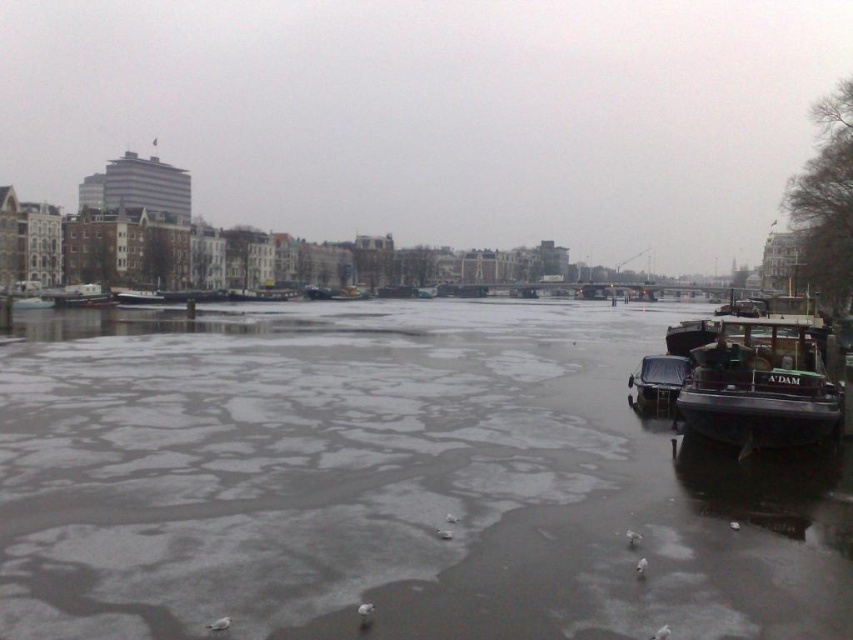
Question: Does dark gray wooden boat at right lie behind dark blue matte boat at right?

Choices:
 (A) yes
 (B) no

Answer: (B)

Question: Which object is farther from the camera taking this photo?

Choices:
 (A) dark gray wooden boat at right
 (B) dark blue matte boat at right

Answer: (B)

Question: Which point is farther to the camera?

Choices:
 (A) dark gray wooden boat at right
 (B) dark blue matte boat at right

Answer: (B)

Question: Which point appears farthest from the camera in this image?

Choices:
 (A) (659, 356)
 (B) (801, 305)

Answer: (B)

Question: Does dark gray wooden boat at right have a greater width compared to dark blue matte boat at right?

Choices:
 (A) no
 (B) yes

Answer: (B)

Question: Does dark gray wooden boat at right lie behind dark blue matte boat at right?

Choices:
 (A) no
 (B) yes

Answer: (A)